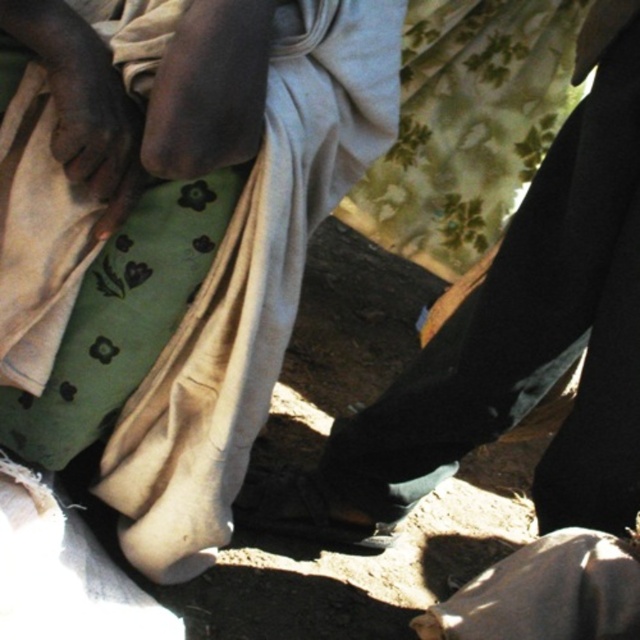
Question: Is green fabric at center further to camera compared to black leather shoe at center?

Choices:
 (A) yes
 (B) no

Answer: (B)

Question: Among these objects, which one is nearest to the camera?

Choices:
 (A) black leather shoe at center
 (B) green fabric at center

Answer: (B)

Question: Can you confirm if green fabric at center is positioned above black leather shoe at center?

Choices:
 (A) yes
 (B) no

Answer: (A)

Question: Is green fabric at center above black leather shoe at center?

Choices:
 (A) yes
 (B) no

Answer: (A)